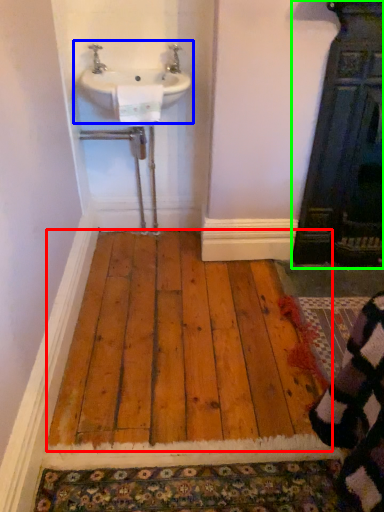
Question: Based on their relative distances, which object is nearer to hardwood (highlighted by a red box)? Choose from sink (highlighted by a blue box) and door (highlighted by a green box).

Choices:
 (A) sink
 (B) door

Answer: (B)